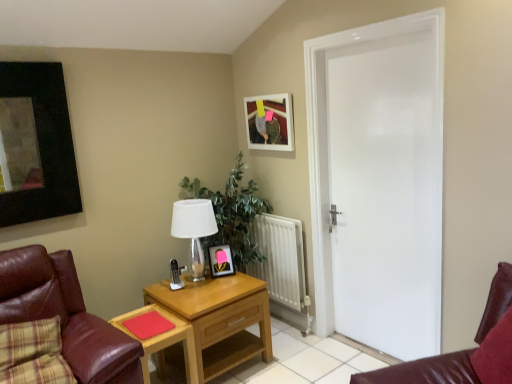
The image size is (512, 384). Find the location of `space that is in front of matte black picture frame at center, placed as the 2th picture frame when sorted from top to bottom`. space that is in front of matte black picture frame at center, placed as the 2th picture frame when sorted from top to bottom is located at coordinates (223, 285).